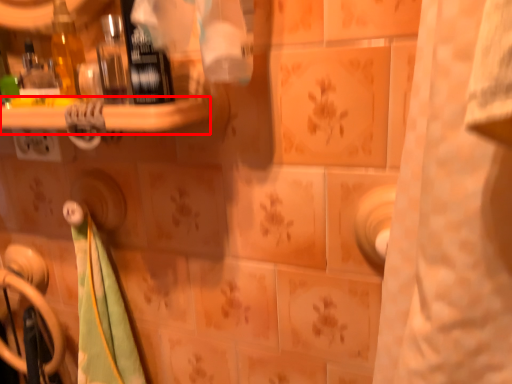
Question: From the image's perspective, what is the correct spatial positioning of ledge (annotated by the red box) in reference to door handle?

Choices:
 (A) below
 (B) above

Answer: (B)